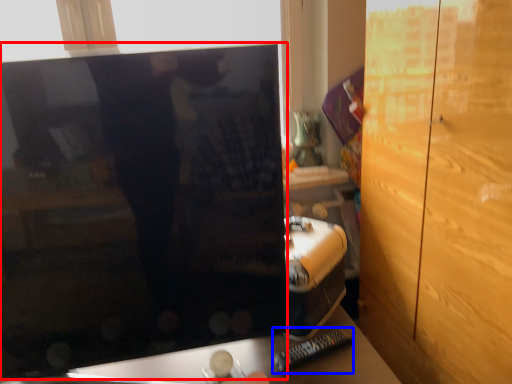
Question: Which object appears farthest to the camera in this image, computer monitor (highlighted by a red box) or remote (highlighted by a blue box)?

Choices:
 (A) computer monitor
 (B) remote

Answer: (B)